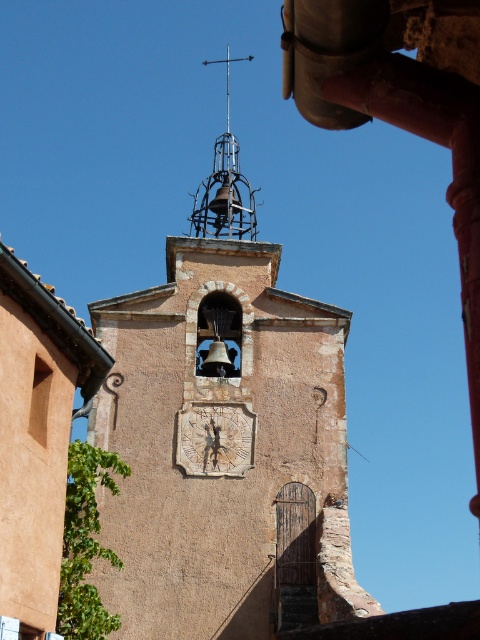
Is brown textured stone clock tower at center to the right of metallic bell tower at upper center from the viewer's perspective?

Indeed, brown textured stone clock tower at center is positioned on the right side of metallic bell tower at upper center.

Between brown textured stone clock tower at center and metallic bell tower at upper center, which one appears on the right side from the viewer's perspective?

From the viewer's perspective, brown textured stone clock tower at center appears more on the right side.

Locate an element on the screen. This screenshot has width=480, height=640. brown textured stone clock tower at center is located at coordinates (226, 476).

Locate an element on the screen. This screenshot has height=640, width=480. brown textured stone clock tower at center is located at coordinates (226, 476).

Is point (204, 636) closer to camera compared to point (216, 432)?

That is True.

Who is taller, brown textured stone clock tower at center or white textured clock at center?

With more height is brown textured stone clock tower at center.

Is point (296, 577) positioned behind point (192, 433)?

No.

Where is `brown textured stone clock tower at center`? brown textured stone clock tower at center is located at coordinates (226, 476).

Is white textured clock at center behind metallic bell tower at upper center?

That is False.

How distant is white textured clock at center from metallic bell tower at upper center?

white textured clock at center is 134.30 feet away from metallic bell tower at upper center.

Does point (199, 420) come behind point (248, 198)?

No.

The height and width of the screenshot is (640, 480). I want to click on white textured clock at center, so click(215, 438).